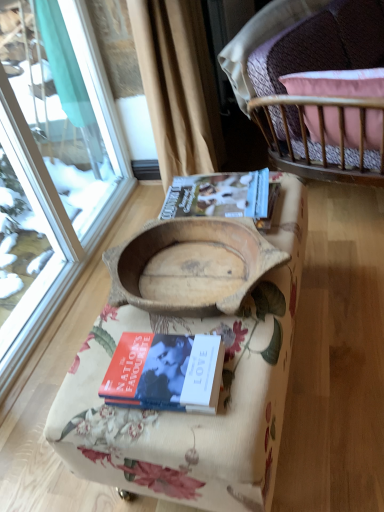
Identify the location of vacant space to the right of wooden bowl at center. Image resolution: width=384 pixels, height=512 pixels. (342, 303).